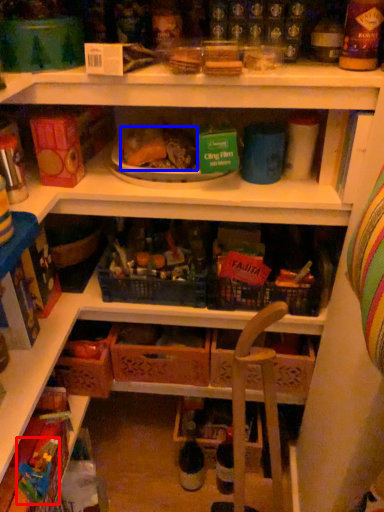
Question: Which point is further to the camera, toy (highlighted by a red box) or food (highlighted by a blue box)?

Choices:
 (A) toy
 (B) food

Answer: (B)